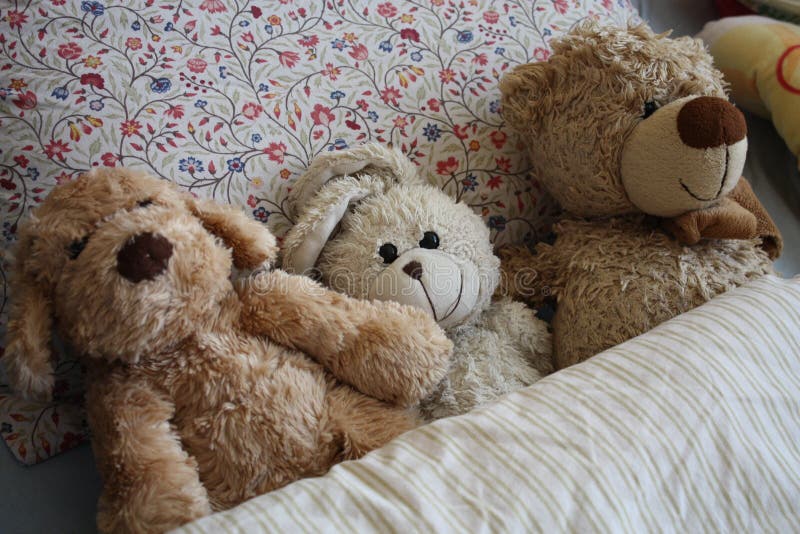
Image resolution: width=800 pixels, height=534 pixels. Find the location of `bed sheets with flower pattern`. bed sheets with flower pattern is located at coordinates (306, 97).